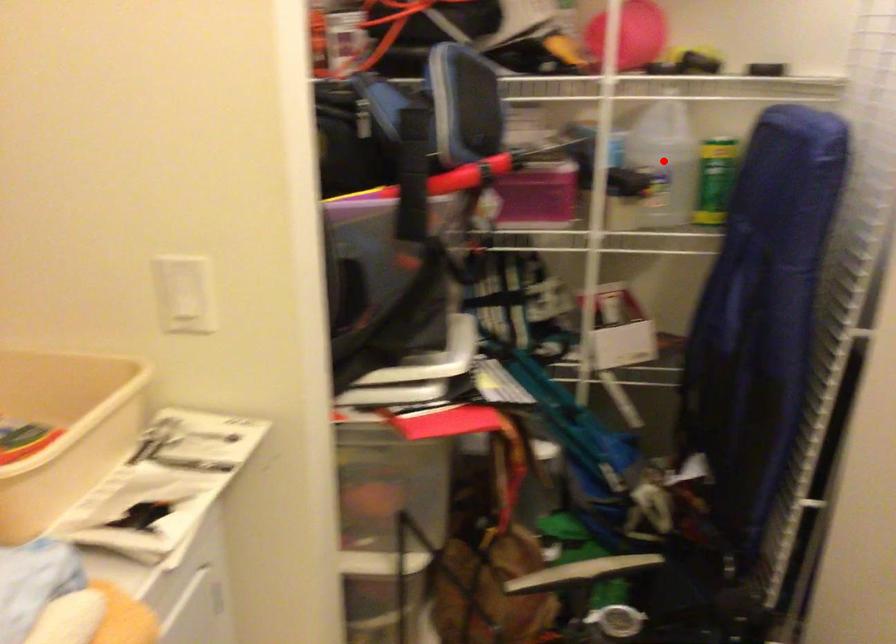
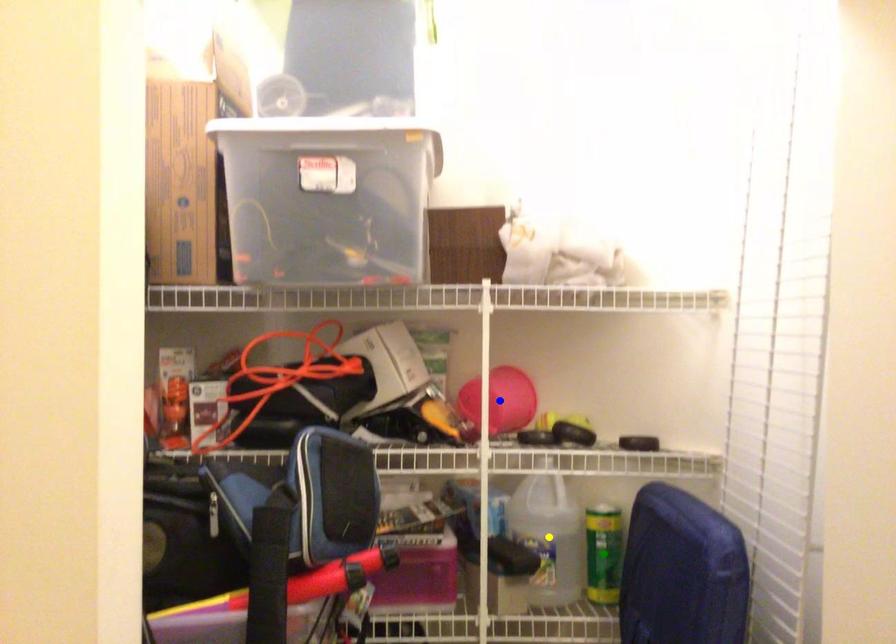
Question: I am providing you with two images of the same scene from different viewpoints. A red point is marked on the first image. You are given multiple points on the second image. In image 2, which mark is for the same physical point as the one in image 1?

Choices:
 (A) blue point
 (B) green point
 (C) yellow point

Answer: (C)